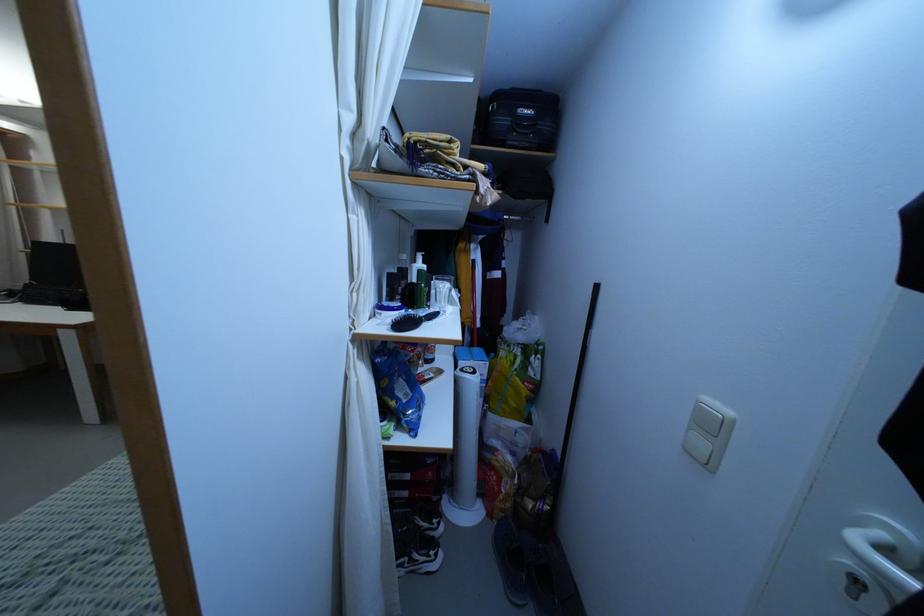
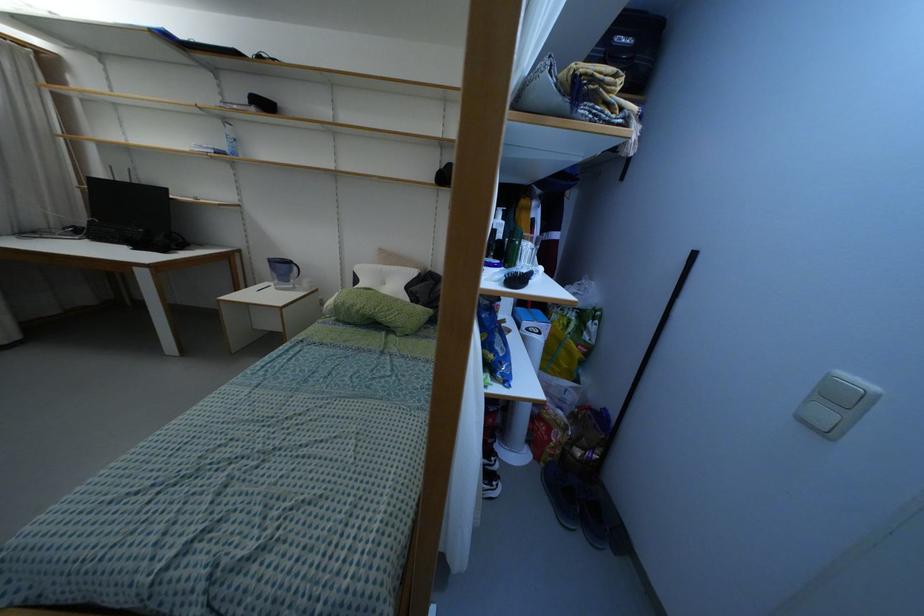
Question: What movement of the cameraman would produce the second image?

Choices:
 (A) Left
 (B) Right
 (C) Forward
 (D) Backward

Answer: (A)